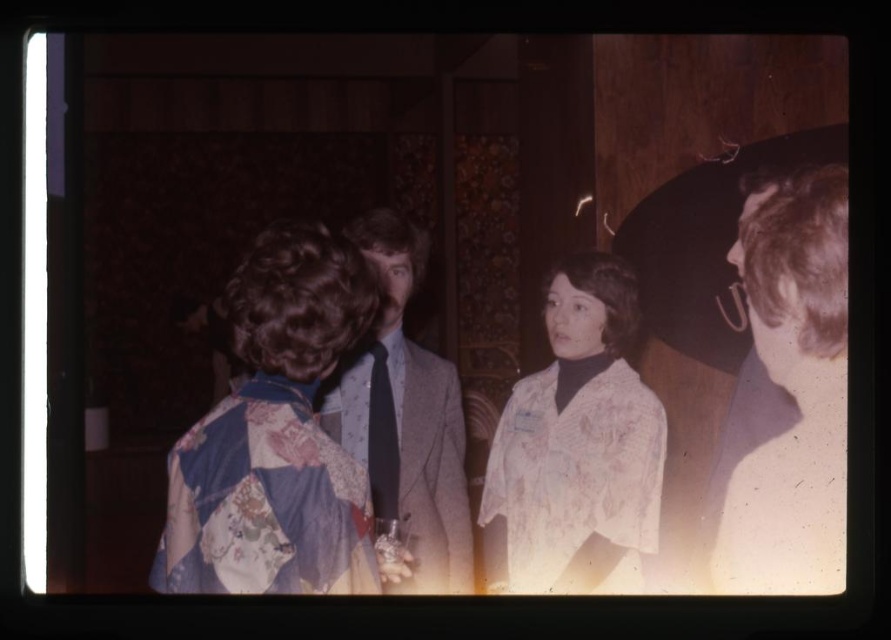
Is point (538, 561) in front of point (459, 556)?

No, it is behind (459, 556).

Does point (496, 470) come closer to viewer compared to point (364, 413)?

No, it is behind (364, 413).

Image resolution: width=891 pixels, height=640 pixels. Find the location of `floral silk blouse at center`. floral silk blouse at center is located at coordinates (576, 448).

In the scene shown: Which of these two, floral fabric dress at center or dark blue silk tie at center, stands taller?

With more height is floral fabric dress at center.

Identify the location of floral fabric dress at center. This screenshot has width=891, height=640. (276, 435).

Measure the distance between floral fabric dress at center and camera.

floral fabric dress at center and camera are 7.48 feet apart.

This screenshot has height=640, width=891. Find the location of `floral fabric dress at center`. floral fabric dress at center is located at coordinates (276, 435).

Which of these two, floral fabric dress at center or floral silk blouse at center, stands taller?

floral fabric dress at center is taller.

Is point (233, 324) less distant than point (624, 292)?

Yes, point (233, 324) is in front of point (624, 292).

In order to click on floral fabric dress at center in this screenshot , I will do `click(276, 435)`.